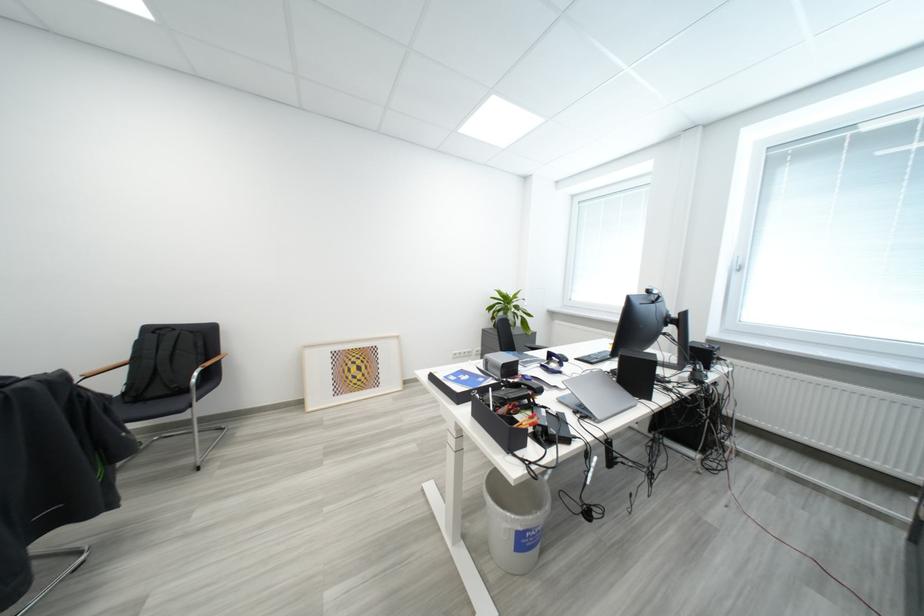
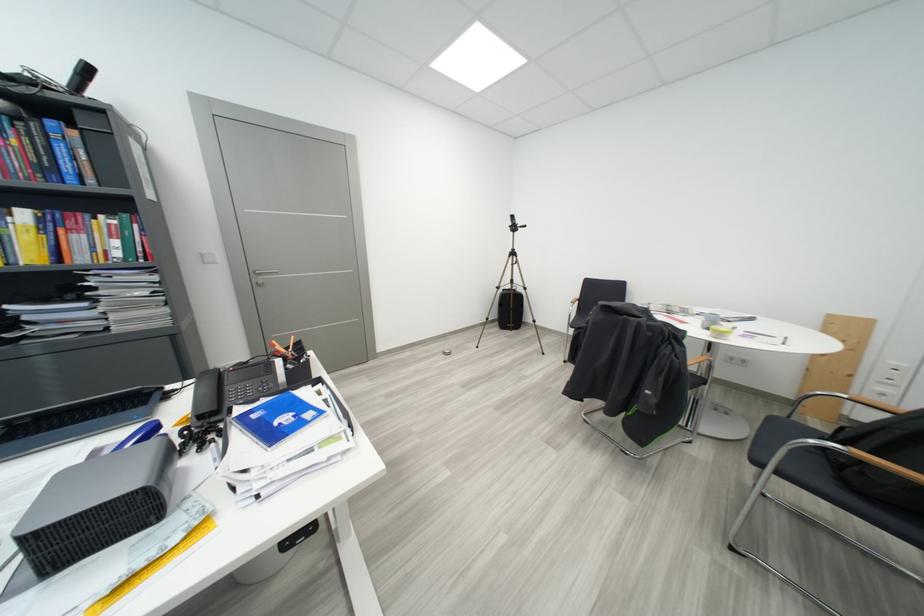
The point at (490, 382) is marked in the first image. Where is the corresponding point in the second image?

(263, 419)